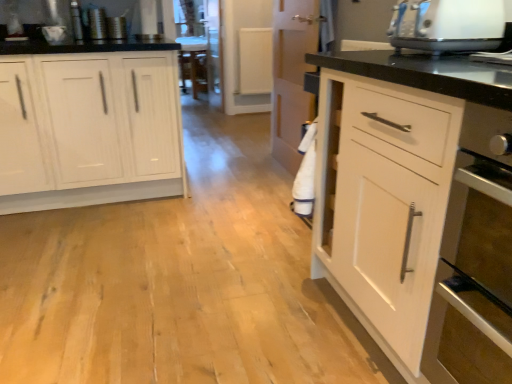
Describe the element at coordinates (89, 129) in the screenshot. I see `white wood cabinet at left` at that location.

The width and height of the screenshot is (512, 384). In order to click on white wood cabinet at left in this screenshot , I will do `click(89, 129)`.

The width and height of the screenshot is (512, 384). Describe the element at coordinates (447, 25) in the screenshot. I see `white plastic toaster at upper right` at that location.

The width and height of the screenshot is (512, 384). In order to click on white plastic toaster at upper right in this screenshot , I will do `click(447, 25)`.

Locate an element on the screen. white wood cabinet at left is located at coordinates (89, 129).

Visually, is white plastic toaster at upper right positioned to the left or to the right of white wood cabinet at left?

Based on their positions, white plastic toaster at upper right is located to the right of white wood cabinet at left.

Is white plastic toaster at upper right in front of white wood cabinet at left?

That is True.

Does point (399, 49) appear closer or farther from the camera than point (7, 102)?

Point (399, 49) appears to be closer to the viewer than point (7, 102).

From the image's perspective, is white plastic toaster at upper right on white wood cabinet at left?

Yes.

From a real-world perspective, is white plastic toaster at upper right below white wood cabinet at left?

No, from a real-world perspective, white plastic toaster at upper right is not below white wood cabinet at left.

Which of these two, white plastic toaster at upper right or white wood cabinet at left, is thinner?

With smaller width is white plastic toaster at upper right.

Does white plastic toaster at upper right have a greater height compared to white wood cabinet at left?

In fact, white plastic toaster at upper right may be shorter than white wood cabinet at left.

Between white plastic toaster at upper right and white wood cabinet at left, which one has smaller size?

white plastic toaster at upper right is smaller.

Is white plastic toaster at upper right completely or partially outside of white wood cabinet at left?

Yes, white plastic toaster at upper right is not within white wood cabinet at left.

Is white plastic toaster at upper right far away from white wood cabinet at left?

Yes, white plastic toaster at upper right and white wood cabinet at left are quite far apart.

Does white plastic toaster at upper right turn towards white wood cabinet at left?

No, white plastic toaster at upper right is not aimed at white wood cabinet at left.

Can you tell me how much white plastic toaster at upper right and white wood cabinet at left differ in facing direction?

92.8 degrees.

The height and width of the screenshot is (384, 512). Identify the location of home appliance on the right of white wood cabinet at left. (447, 25).

Considering the relative positions of white wood cabinet at left and white plastic toaster at upper right in the image provided, is white wood cabinet at left to the left of white plastic toaster at upper right from the viewer's perspective?

Indeed, white wood cabinet at left is positioned on the left side of white plastic toaster at upper right.

Is the depth of white wood cabinet at left greater than that of white plastic toaster at upper right?

Yes, it is.

Which is closer, (x=170, y=190) or (x=400, y=18)?

The point (x=400, y=18) is in front.

From the image's perspective, is white wood cabinet at left located above or below white plastic toaster at upper right?

From the image's perspective, white wood cabinet at left appears below white plastic toaster at upper right.

From a real-world perspective, between white wood cabinet at left and white plastic toaster at upper right, who is vertically lower?

From a 3D spatial view, white wood cabinet at left is below.

Is white wood cabinet at left wider than white plastic toaster at upper right?

Correct, the width of white wood cabinet at left exceeds that of white plastic toaster at upper right.

Who is taller, white wood cabinet at left or white plastic toaster at upper right?

Standing taller between the two is white wood cabinet at left.

Who is bigger, white wood cabinet at left or white plastic toaster at upper right?

Bigger between the two is white wood cabinet at left.

Which is correct: white wood cabinet at left is inside white plastic toaster at upper right, or outside of it?

white wood cabinet at left is located beyond the bounds of white plastic toaster at upper right.

Based on the photo, is white wood cabinet at left next to white plastic toaster at upper right?

No, white wood cabinet at left is not touching white plastic toaster at upper right.

Could you tell me if white wood cabinet at left is facing white plastic toaster at upper right?

No, white wood cabinet at left is not oriented towards white plastic toaster at upper right.

The width and height of the screenshot is (512, 384). In order to click on home appliance above the white wood cabinet at left (from the image's perspective) in this screenshot , I will do `click(447, 25)`.

Image resolution: width=512 pixels, height=384 pixels. I want to click on cabinetry below the white plastic toaster at upper right (from the image's perspective), so click(x=89, y=129).

Find the location of a particular element. cabinetry behind the white plastic toaster at upper right is located at coordinates (89, 129).